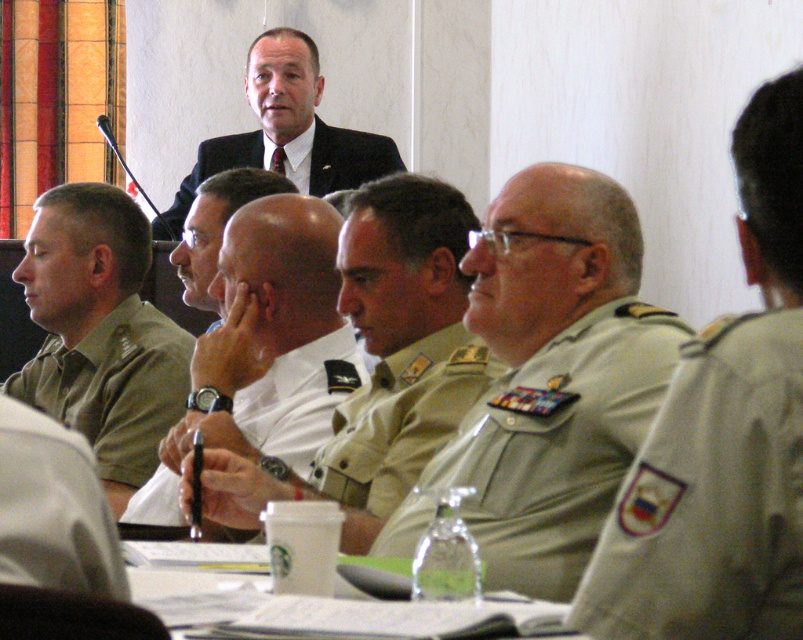
Does white uniform at center appear on the left side of white paper at center?

Indeed, white uniform at center is positioned on the left side of white paper at center.

Which is behind, point (245, 317) or point (157, 547)?

Positioned behind is point (245, 317).

Between point (280, 282) and point (557, 612), which one is positioned in front?

Point (557, 612) is more forward.

Find the location of a particular element. This screenshot has height=640, width=803. white uniform at center is located at coordinates tap(265, 340).

Based on the photo, is light olive green fabric uniform at center bigger than white paper at center?

Indeed, light olive green fabric uniform at center has a larger size compared to white paper at center.

The width and height of the screenshot is (803, 640). Describe the element at coordinates (549, 449) in the screenshot. I see `light olive green fabric uniform at center` at that location.

The image size is (803, 640). What do you see at coordinates (549, 449) in the screenshot?
I see `light olive green fabric uniform at center` at bounding box center [549, 449].

I want to click on light olive green fabric uniform at center, so click(549, 449).

Does green fabric uniform at right appear over black suit at upper center?

Incorrect, green fabric uniform at right is not positioned above black suit at upper center.

Does green fabric uniform at right have a lesser height compared to black suit at upper center?

Correct, green fabric uniform at right is not as tall as black suit at upper center.

Between point (638, 630) and point (182, 209), which one is positioned behind?

The point (182, 209) is more distant.

At what (x,y) coordinates should I click in order to perform the action: click on green fabric uniform at right. Please return your answer as a coordinate pair (x, y). Image resolution: width=803 pixels, height=640 pixels. Looking at the image, I should click on (710, 497).